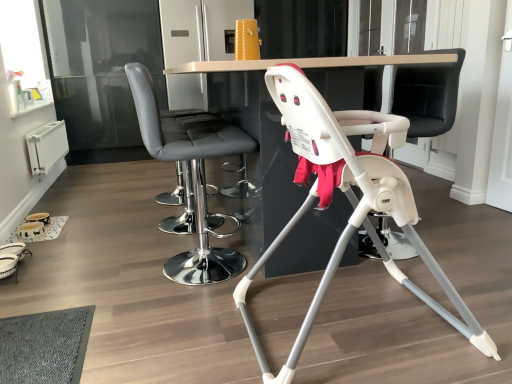
I want to click on vacant area situated below white plastic highchair at center, which is the first chair in right-to-left order (from a real-world perspective), so click(x=361, y=325).